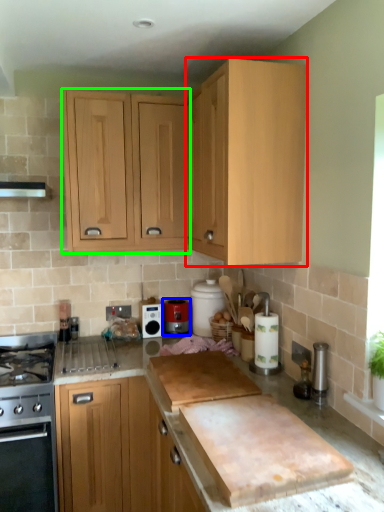
Question: Which object is positioned farthest from cabinetry (highlighted by a red box)? Select from kitchen appliance (highlighted by a blue box) and cabinetry (highlighted by a green box).

Choices:
 (A) kitchen appliance
 (B) cabinetry

Answer: (A)